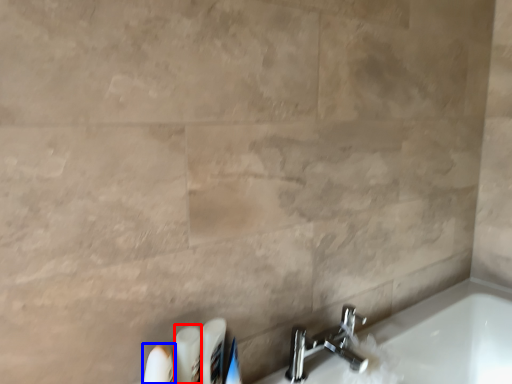
Question: Among these objects, which one is nearest to the camera, toiletry (highlighted by a red box) or toiletry (highlighted by a blue box)?

Choices:
 (A) toiletry
 (B) toiletry

Answer: (B)